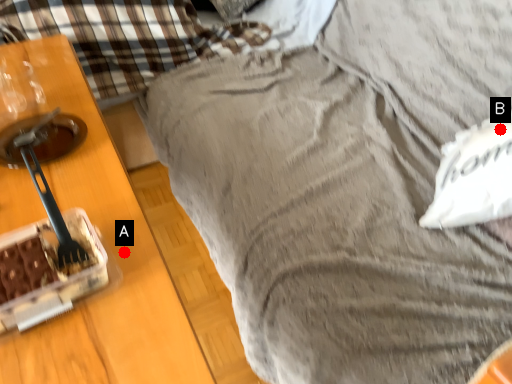
Question: Two points are circled on the image, labeled by A and B beside each circle. Which point is farther to the camera?

Choices:
 (A) A is further
 (B) B is further

Answer: (B)